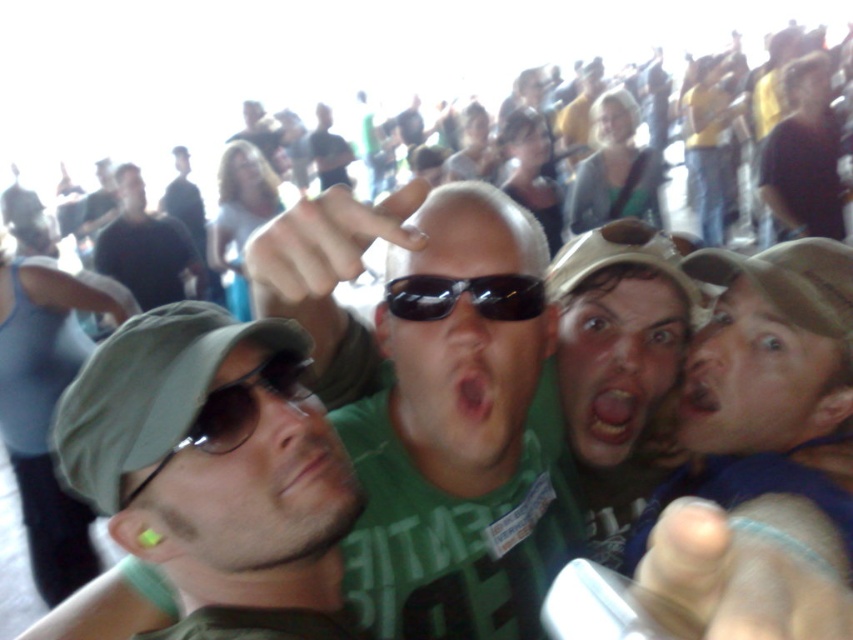
Question: Is sunglasses at left below sunglasses at center?

Choices:
 (A) yes
 (B) no

Answer: (A)

Question: Which of the following is the closest to the observer?

Choices:
 (A) green matte cap at left
 (B) sunglasses at left
 (C) sunglasses at center
 (D) dark gray cap at left

Answer: (A)

Question: Which of the following is the closest to the observer?

Choices:
 (A) (236, 412)
 (B) (184, 244)
 (C) (508, 312)
 (D) (331, 552)

Answer: (A)

Question: Can you confirm if green matte cap at left is positioned below sunglasses at left?

Choices:
 (A) no
 (B) yes

Answer: (B)

Question: Does green matte cap at left appear under dark gray cap at left?

Choices:
 (A) yes
 (B) no

Answer: (A)

Question: Which point is closer to the camera?

Choices:
 (A) (144, 198)
 (B) (189, 588)
 (C) (277, 358)

Answer: (B)